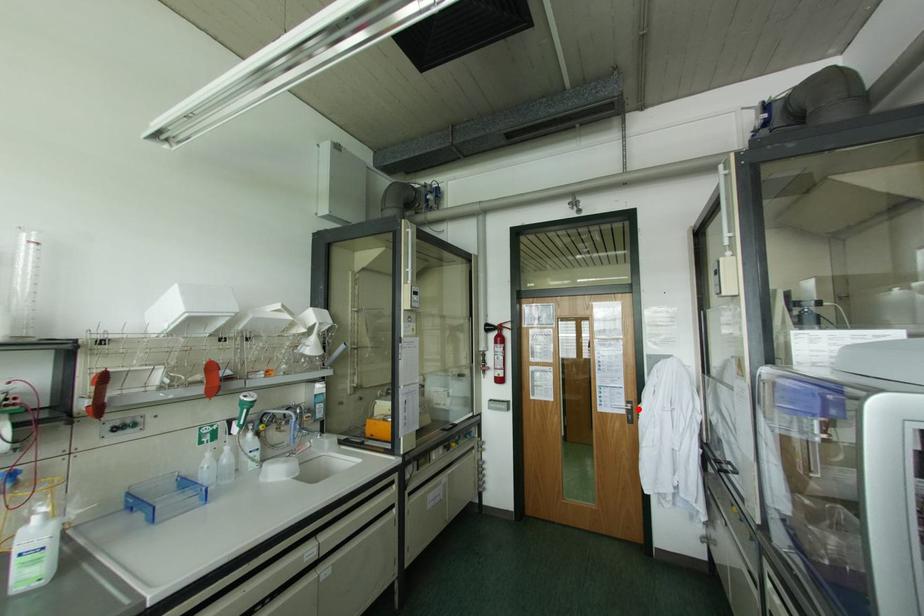
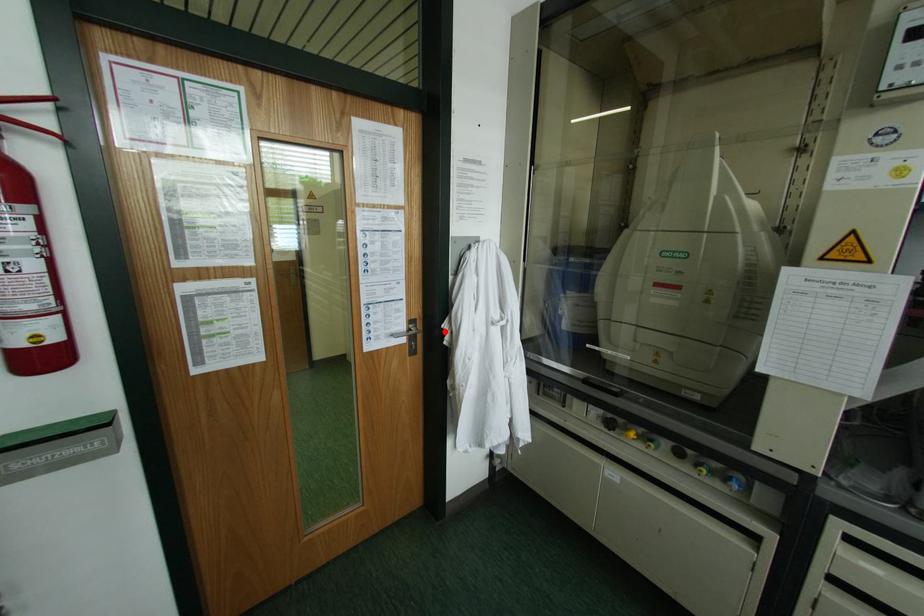
I am providing you with two images of the same scene from different viewpoints. A red point is marked on the first image and another point is marked on the second image. Is the marked point in image1 the same physical position as the marked point in image2?

Yes